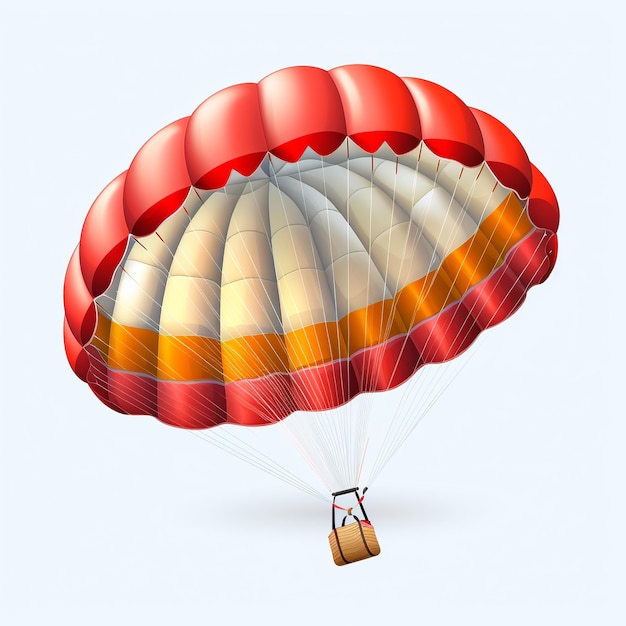
Find the location of a particular element. The width and height of the screenshot is (626, 626). cable is located at coordinates (342, 404).